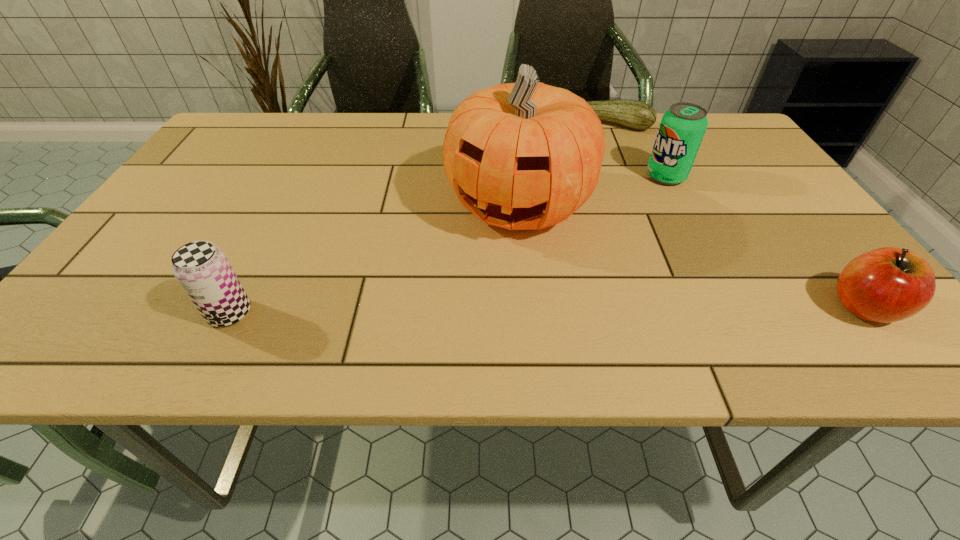
Find the location of a particular element. The image size is (960, 540). vacant space positioned 0.070m on the front-facing side of the pop soda is located at coordinates (637, 195).

The height and width of the screenshot is (540, 960). What are the coordinates of `free location located on the front-facing side of the pumpkin` in the screenshot? It's located at (467, 302).

Identify the location of blank space located on the front-facing side of the pumpkin. (464, 306).

This screenshot has width=960, height=540. In order to click on vacant space located on the front-facing side of the pumpkin in this screenshot , I will do `click(468, 298)`.

You are a GUI agent. You are given a task and a screenshot of the screen. Output one action in this format:
    pyautogui.click(x=<x>, y=<y>)
    Task: Click on the free space located 0.320m at the stem end of the farthest object
    
    Given the screenshot: What is the action you would take?
    pyautogui.click(x=567, y=198)

I want to click on free space located at the stem end of the farthest object, so click(x=573, y=184).

I want to click on free space located at the stem end of the farthest object, so point(577,173).

Identify the location of object at the far edge. (638, 115).

The height and width of the screenshot is (540, 960). Identify the location of beer can at the near edge. (202, 269).

I want to click on apple that is at the near edge, so click(884, 285).